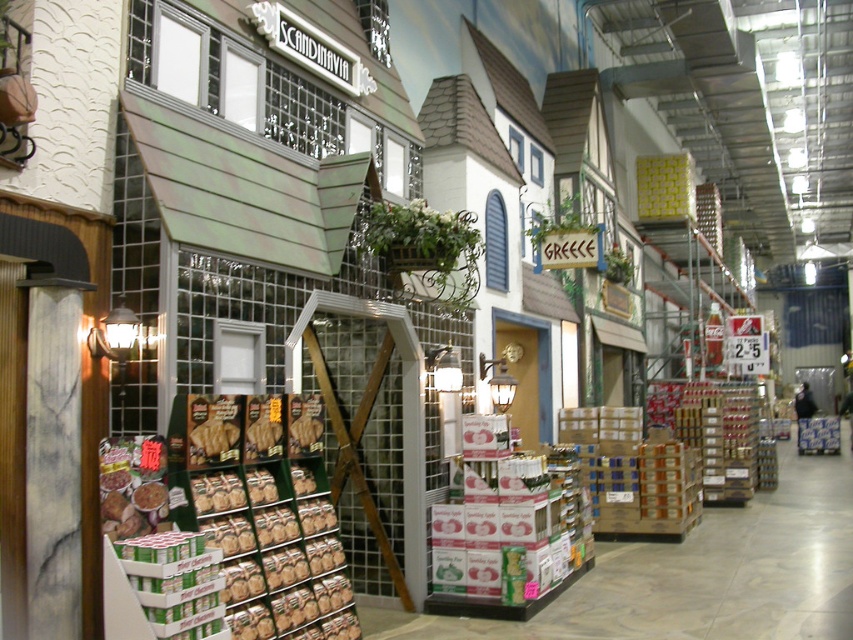
Between matte brown bread at center and brown crumbly bread at center, which one appears on the left side from the viewer's perspective?

From the viewer's perspective, brown crumbly bread at center appears more on the left side.

Is matte brown bread at center to the right of brown crumbly bread at center from the viewer's perspective?

Correct, you'll find matte brown bread at center to the right of brown crumbly bread at center.

Does point (291, 433) come farther from viewer compared to point (253, 440)?

Yes, it is behind point (253, 440).

Find the location of `matte brown bread at center`. matte brown bread at center is located at coordinates (305, 435).

Is green cardboard boxes at center further to camera compared to matte brown bread at center?

That is False.

Find the location of a particular element. green cardboard boxes at center is located at coordinates (228, 529).

This screenshot has height=640, width=853. In order to click on green cardboard boxes at center in this screenshot , I will do `click(228, 529)`.

Between matte brown bread at center and brown matte cookies at center, which one is positioned higher?

brown matte cookies at center is above.

Is point (309, 451) closer to viewer compared to point (215, 438)?

No.

Locate an element on the screen. The width and height of the screenshot is (853, 640). matte brown bread at center is located at coordinates (305, 435).